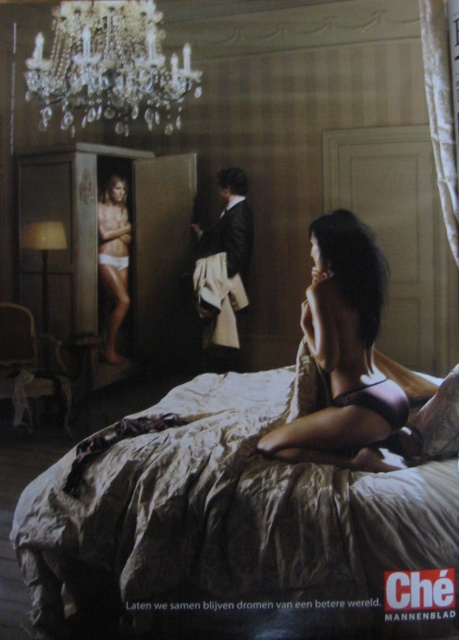
Question: Which is nearer to the satin black lingerie at center?

Choices:
 (A) white matte underwear at center
 (B) crystal glass chandelier at upper center
 (C) leather jacket at center
 (D) silky white sheets at center

Answer: (D)

Question: Which object appears farthest from the camera in this image?

Choices:
 (A) satin black lingerie at center
 (B) crystal glass chandelier at upper center
 (C) leather jacket at center
 (D) silky white sheets at center

Answer: (C)

Question: Which of these objects is positioned farthest from the leather jacket at center?

Choices:
 (A) crystal glass chandelier at upper center
 (B) silky white sheets at center
 (C) white matte underwear at center
 (D) satin black lingerie at center

Answer: (D)

Question: Can you confirm if satin black lingerie at center is thinner than leather jacket at center?

Choices:
 (A) yes
 (B) no

Answer: (B)

Question: Can you confirm if silky white sheets at center is positioned to the right of leather jacket at center?

Choices:
 (A) no
 (B) yes

Answer: (B)

Question: Does crystal glass chandelier at upper center have a lesser width compared to leather jacket at center?

Choices:
 (A) yes
 (B) no

Answer: (B)